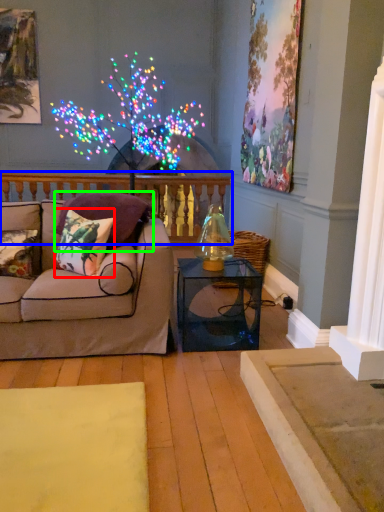
Question: Based on their relative distances, which object is farther from pillow (highlighted by a red box)? Choose from balustrade (highlighted by a blue box) and pillow (highlighted by a green box).

Choices:
 (A) balustrade
 (B) pillow

Answer: (A)